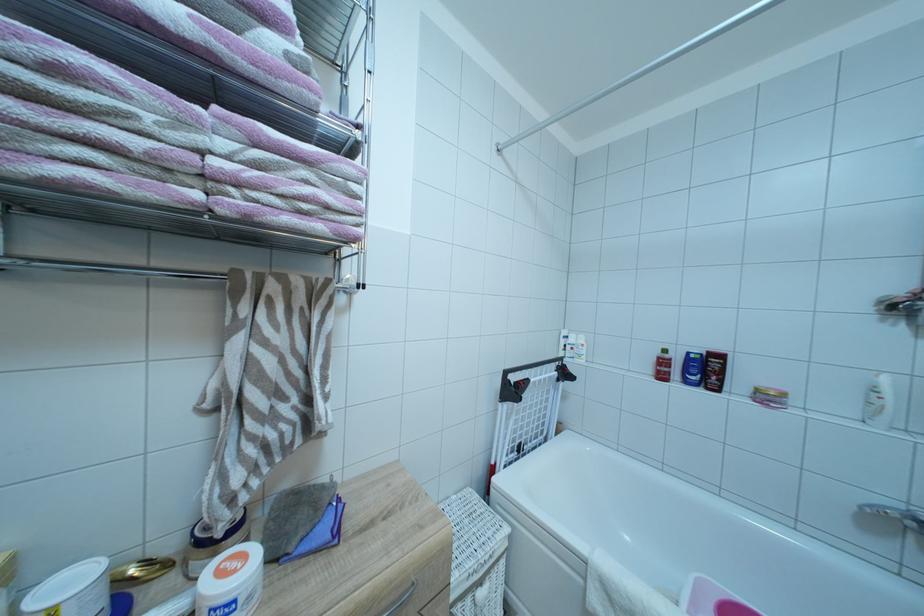
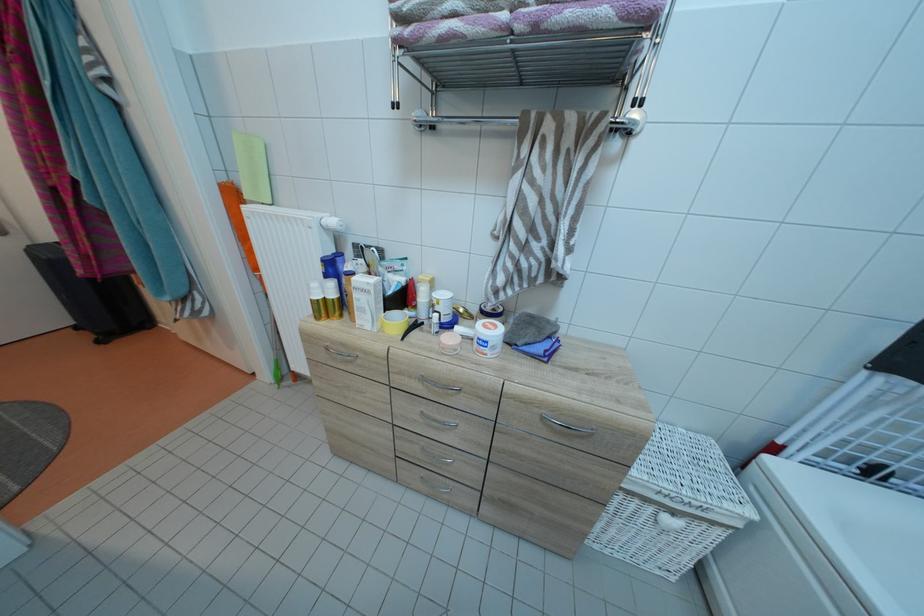
The point at (x=335, y=286) is marked in the first image. Where is the corresponding point in the second image?

(611, 120)